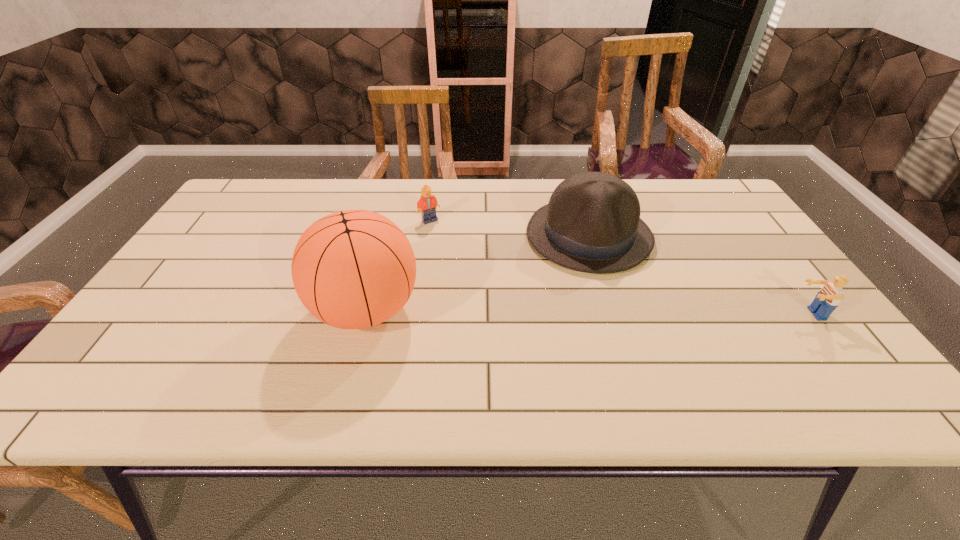
The image size is (960, 540). I want to click on free spot on the desktop that is between the tallest object and the right Lego and is positioned on the front-facing side of the fourth shortest object, so click(522, 311).

The height and width of the screenshot is (540, 960). Find the location of `free spot on the desktop that is between the tallest object and the rightmost object and is positioned on the front-facing side of the farther Lego`. free spot on the desktop that is between the tallest object and the rightmost object and is positioned on the front-facing side of the farther Lego is located at coordinates (584, 312).

Locate an element on the screen. The image size is (960, 540). free space on the desktop that is between the basketball and the rightmost object and is positioned on the shell of the shortest object is located at coordinates (523, 311).